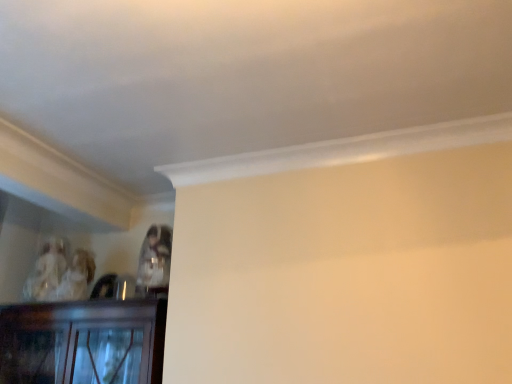
Question: Would you say matte plastic cup at upper center, the second person viewed from the back, is a long distance from matte white porcelain figurine at upper left, arranged as the 1th person when viewed from the left?

Choices:
 (A) yes
 (B) no

Answer: (B)

Question: From a real-world perspective, does matte plastic cup at upper center, the second person viewed from the back, sit lower than matte white porcelain figurine at upper left, the 1th person when ordered from back to front?

Choices:
 (A) no
 (B) yes

Answer: (B)

Question: Does matte plastic cup at upper center, the second person viewed from the back, contain matte white porcelain figurine at upper left, positioned as the 2th person in front-to-back order?

Choices:
 (A) yes
 (B) no

Answer: (B)

Question: Can you confirm if matte plastic cup at upper center, which is the 1th person from right to left, is shorter than matte white porcelain figurine at upper left, which is the 2th person in right-to-left order?

Choices:
 (A) yes
 (B) no

Answer: (A)

Question: Is matte plastic cup at upper center, acting as the 1th person starting from the front, looking in the opposite direction of matte white porcelain figurine at upper left, the 1th person when ordered from back to front?

Choices:
 (A) no
 (B) yes

Answer: (A)

Question: Is matte plastic cup at upper center, the second person in the left-to-right sequence, closer to camera compared to matte white porcelain figurine at upper left, arranged as the 1th person when viewed from the left?

Choices:
 (A) no
 (B) yes

Answer: (B)

Question: Is matte white porcelain figurine at upper left, which is the 2th person in right-to-left order, outside matte plastic cup at upper center, which is the 1th person from right to left?

Choices:
 (A) no
 (B) yes

Answer: (B)

Question: Is matte white porcelain figurine at upper left, positioned as the 2th person in front-to-back order, oriented towards matte plastic cup at upper center, the second person viewed from the back?

Choices:
 (A) no
 (B) yes

Answer: (A)

Question: Is matte white porcelain figurine at upper left, the 1th person when ordered from back to front, not near matte plastic cup at upper center, the second person in the left-to-right sequence?

Choices:
 (A) no
 (B) yes

Answer: (A)

Question: Considering the relative positions of matte white porcelain figurine at upper left, arranged as the 1th person when viewed from the left, and matte plastic cup at upper center, the second person viewed from the back, in the image provided, is matte white porcelain figurine at upper left, arranged as the 1th person when viewed from the left, to the right of matte plastic cup at upper center, the second person viewed from the back, from the viewer's perspective?

Choices:
 (A) no
 (B) yes

Answer: (A)

Question: From a real-world perspective, is matte white porcelain figurine at upper left, positioned as the 2th person in front-to-back order, positioned over matte plastic cup at upper center, acting as the 1th person starting from the front, based on gravity?

Choices:
 (A) no
 (B) yes

Answer: (B)

Question: Considering the relative sizes of matte white porcelain figurine at upper left, which is the 2th person in right-to-left order, and matte plastic cup at upper center, the second person viewed from the back, in the image provided, is matte white porcelain figurine at upper left, which is the 2th person in right-to-left order, taller than matte plastic cup at upper center, the second person viewed from the back,?

Choices:
 (A) no
 (B) yes

Answer: (B)

Question: In terms of height, does matte white porcelain figurine at upper left, which is the 2th person in right-to-left order, look taller or shorter compared to matte plastic cup at upper center, the second person in the left-to-right sequence?

Choices:
 (A) tall
 (B) short

Answer: (A)